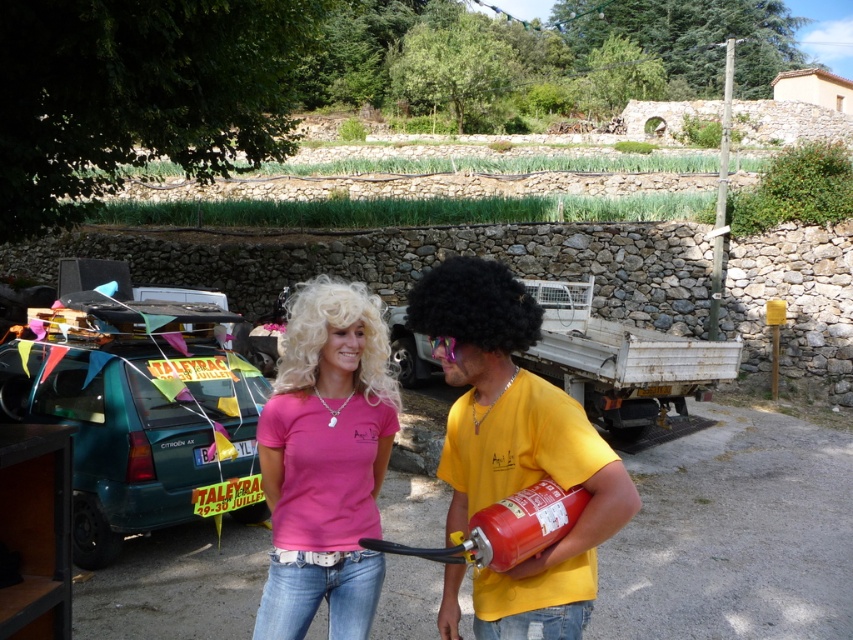
Question: Which point is closer to the camera?

Choices:
 (A) (463, 552)
 (B) (606, 513)

Answer: (B)

Question: Which object is positioned closest to the pink matte t-shirt at center?

Choices:
 (A) matte yellow t-shirt at center
 (B) blonde curly hair at center
 (C) black curly wig at center
 (D) red matte extinguisher at center

Answer: (A)

Question: From the image, what is the correct spatial relationship of matte yellow t-shirt at center in relation to black curly wig at center?

Choices:
 (A) right
 (B) left

Answer: (A)

Question: Is matte yellow t-shirt at center to the left of blonde curly hair at center from the viewer's perspective?

Choices:
 (A) yes
 (B) no

Answer: (B)

Question: Is matte yellow t-shirt at center bigger than black curly wig at center?

Choices:
 (A) no
 (B) yes

Answer: (B)

Question: Estimate the real-world distances between objects in this image. Which object is closer to the matte yellow t-shirt at center?

Choices:
 (A) black curly wig at center
 (B) pink matte t-shirt at center

Answer: (A)